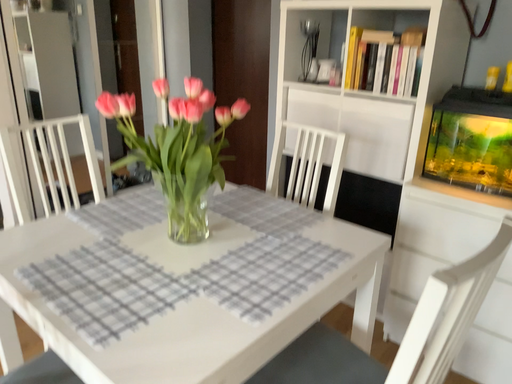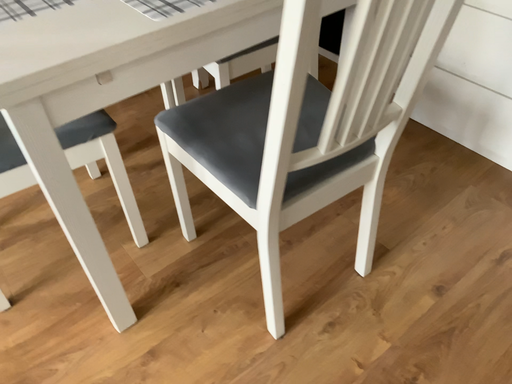
Question: How did the camera likely rotate when shooting the video?

Choices:
 (A) rotated right
 (B) rotated left

Answer: (B)